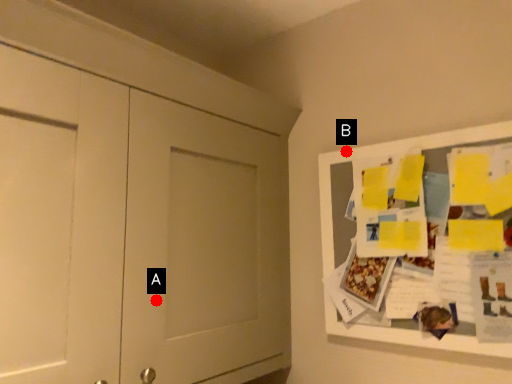
Question: Two points are circled on the image, labeled by A and B beside each circle. Which point is further to the camera?

Choices:
 (A) A is further
 (B) B is further

Answer: (B)